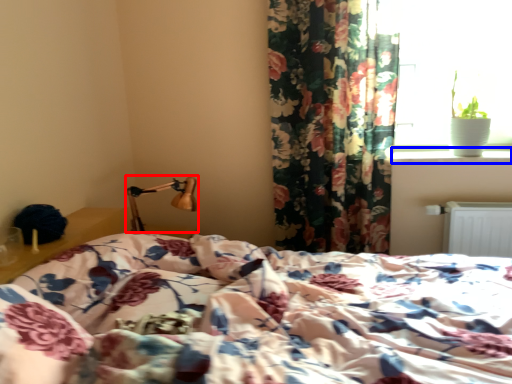
Question: Which object is further to the camera taking this photo, bedside lamp (highlighted by a red box) or window sill (highlighted by a blue box)?

Choices:
 (A) bedside lamp
 (B) window sill

Answer: (B)